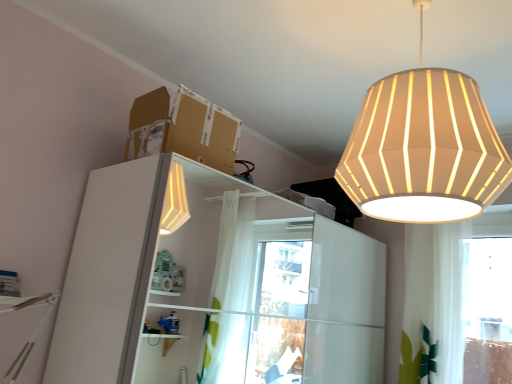
Question: From a real-world perspective, is white glossy dresser at left located higher than brown cardboard box at upper center?

Choices:
 (A) yes
 (B) no

Answer: (B)

Question: Is brown cardboard box at upper center inside white glossy dresser at left?

Choices:
 (A) yes
 (B) no

Answer: (B)

Question: Considering the relative positions of white glossy dresser at left and brown cardboard box at upper center in the image provided, is white glossy dresser at left to the right of brown cardboard box at upper center from the viewer's perspective?

Choices:
 (A) no
 (B) yes

Answer: (B)

Question: Considering the relative positions of white glossy dresser at left and brown cardboard box at upper center in the image provided, is white glossy dresser at left to the left of brown cardboard box at upper center from the viewer's perspective?

Choices:
 (A) no
 (B) yes

Answer: (A)

Question: Does white glossy dresser at left have a lesser width compared to brown cardboard box at upper center?

Choices:
 (A) yes
 (B) no

Answer: (B)

Question: From the image's perspective, is white fabric lampshade at upper right positioned above or below brown cardboard box at upper center?

Choices:
 (A) below
 (B) above

Answer: (B)

Question: Relative to brown cardboard box at upper center, is white fabric lampshade at upper right in front or behind?

Choices:
 (A) behind
 (B) front

Answer: (B)

Question: Is white fabric lampshade at upper right taller or shorter than brown cardboard box at upper center?

Choices:
 (A) tall
 (B) short

Answer: (A)

Question: Which is correct: white fabric lampshade at upper right is inside brown cardboard box at upper center, or outside of it?

Choices:
 (A) inside
 (B) outside

Answer: (B)

Question: In the image, is white fabric lampshade at upper right positioned in front of or behind white glossy dresser at left?

Choices:
 (A) behind
 (B) front

Answer: (B)

Question: Considering the positions of point (347, 180) and point (64, 286), is point (347, 180) closer or farther from the camera than point (64, 286)?

Choices:
 (A) farther
 (B) closer

Answer: (B)

Question: In terms of width, does white fabric lampshade at upper right look wider or thinner when compared to white glossy dresser at left?

Choices:
 (A) thin
 (B) wide

Answer: (A)

Question: Considering the positions of white fabric lampshade at upper right and white glossy dresser at left in the image, is white fabric lampshade at upper right bigger or smaller than white glossy dresser at left?

Choices:
 (A) small
 (B) big

Answer: (A)

Question: From a real-world perspective, is brown cardboard box at upper center physically located above or below white fabric lampshade at upper right?

Choices:
 (A) below
 (B) above

Answer: (A)

Question: Relative to white fabric lampshade at upper right, is brown cardboard box at upper center in front or behind?

Choices:
 (A) front
 (B) behind

Answer: (B)